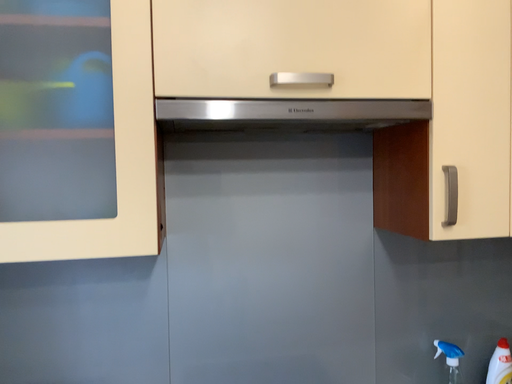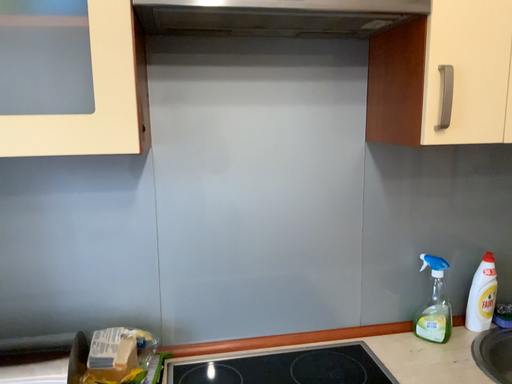
Question: Which way did the camera rotate in the video?

Choices:
 (A) rotated downward
 (B) rotated upward

Answer: (A)